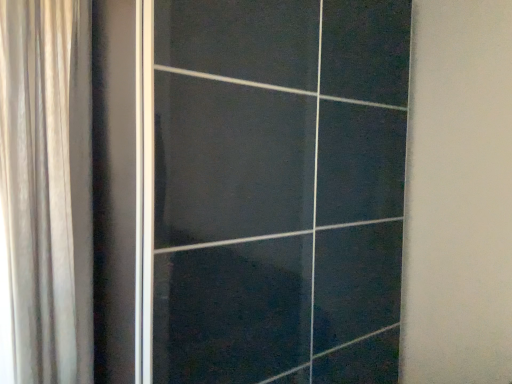
Question: From a real-world perspective, is black glossy door at center below silky beige curtain at left?

Choices:
 (A) no
 (B) yes

Answer: (B)

Question: Is black glossy door at center turned away from silky beige curtain at left?

Choices:
 (A) no
 (B) yes

Answer: (A)

Question: Is black glossy door at center facing towards silky beige curtain at left?

Choices:
 (A) no
 (B) yes

Answer: (A)

Question: Would you say black glossy door at center is a long distance from silky beige curtain at left?

Choices:
 (A) no
 (B) yes

Answer: (A)

Question: From the image's perspective, is black glossy door at center on silky beige curtain at left?

Choices:
 (A) yes
 (B) no

Answer: (B)

Question: Does black glossy door at center have a larger size compared to silky beige curtain at left?

Choices:
 (A) yes
 (B) no

Answer: (A)

Question: Does silky beige curtain at left have a larger size compared to black glossy door at center?

Choices:
 (A) no
 (B) yes

Answer: (A)

Question: Is silky beige curtain at left looking in the opposite direction of black glossy door at center?

Choices:
 (A) no
 (B) yes

Answer: (A)

Question: Is silky beige curtain at left in front of black glossy door at center?

Choices:
 (A) yes
 (B) no

Answer: (B)

Question: From a real-world perspective, is silky beige curtain at left on black glossy door at center?

Choices:
 (A) no
 (B) yes

Answer: (B)

Question: Is silky beige curtain at left not near black glossy door at center?

Choices:
 (A) no
 (B) yes

Answer: (A)

Question: Is silky beige curtain at left outside of black glossy door at center?

Choices:
 (A) no
 (B) yes

Answer: (B)

Question: From a real-world perspective, is silky beige curtain at left physically located above or below black glossy door at center?

Choices:
 (A) below
 (B) above

Answer: (B)